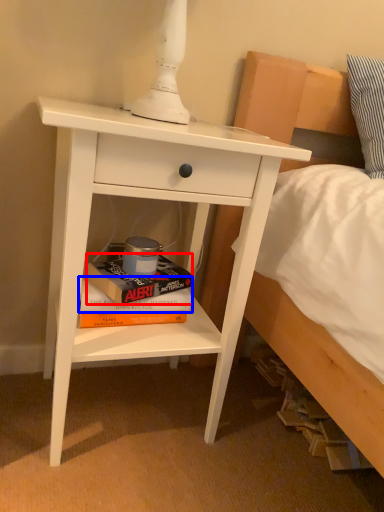
Question: Among these objects, which one is nearest to the camera, paperback book (highlighted by a red box) or paperback book (highlighted by a blue box)?

Choices:
 (A) paperback book
 (B) paperback book

Answer: (A)